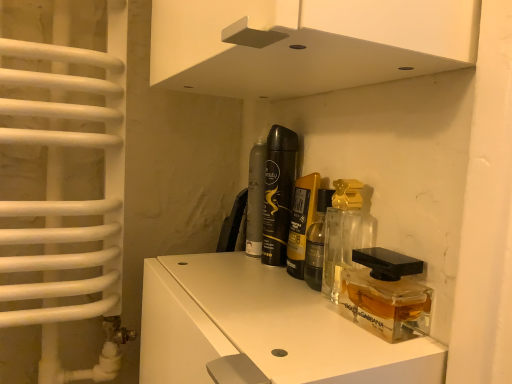
The width and height of the screenshot is (512, 384). What are the coordinates of `vacant space in front of matte black perfume at center, positioned as the 1th perfume in back-to-front order` in the screenshot? It's located at (248, 286).